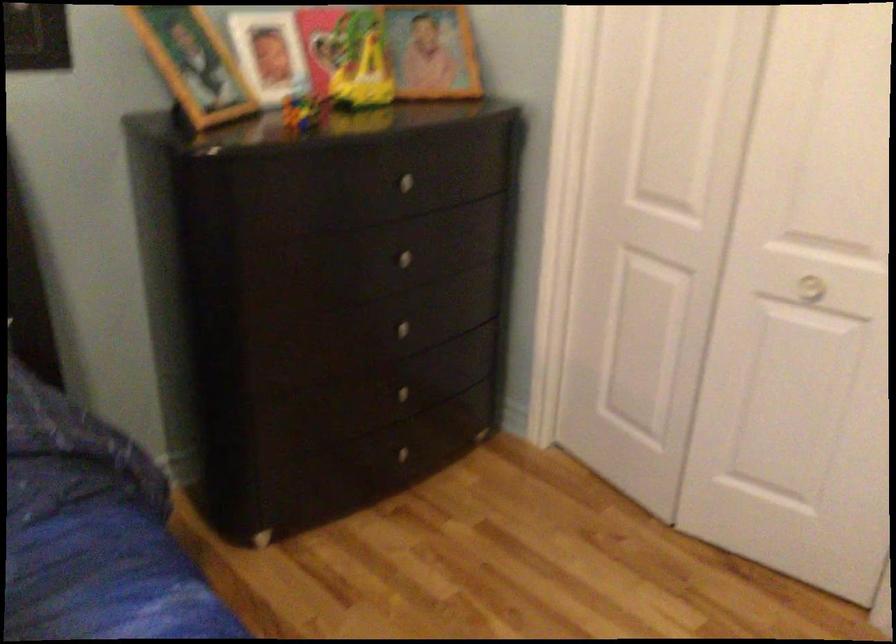
Image resolution: width=896 pixels, height=644 pixels. What do you see at coordinates (810, 288) in the screenshot?
I see `a white door knob` at bounding box center [810, 288].